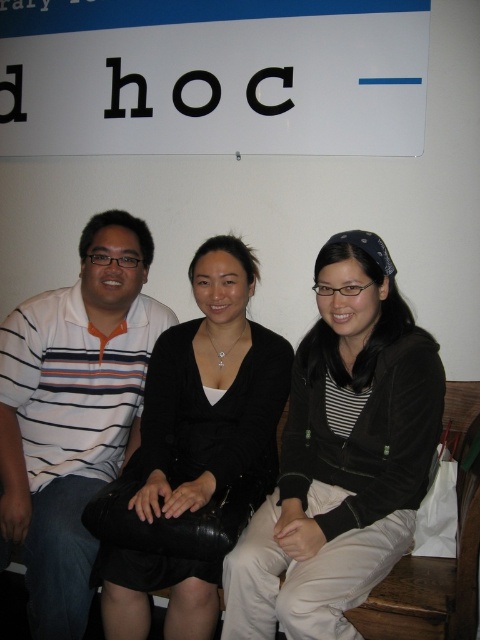
You are a tailor who needs to measure the space between two garments hanging on a rack. You see the black velvet jacket at center and the black matte dress at center. Can you fit a 9 inch wide hanger between them?

The distance between the black velvet jacket at center and the black matte dress at center is 8.86 inches, which is slightly less than 9 inches. Therefore, a 9 inch wide hanger might not fit comfortably between them.

You are a photographer trying to capture a group photo of the three people sitting on the bench. The white paper sign at upper center and the black velvet jacket at center are both in the frame. Since the photographer wants to ensure that the sign is wider than the jacket in the photo, does the current arrangement already satisfy this requirement?

The white paper sign at upper center is wider than the black velvet jacket at center, so the current arrangement already satisfies the requirement that the sign is wider than the jacket in the photo.